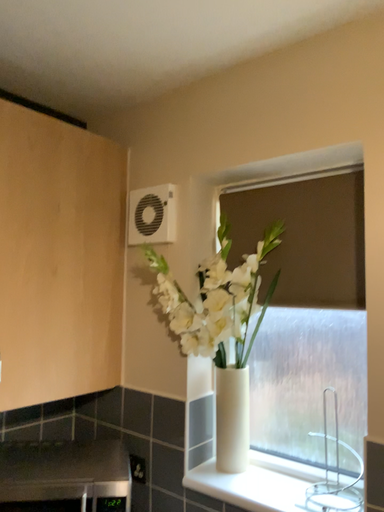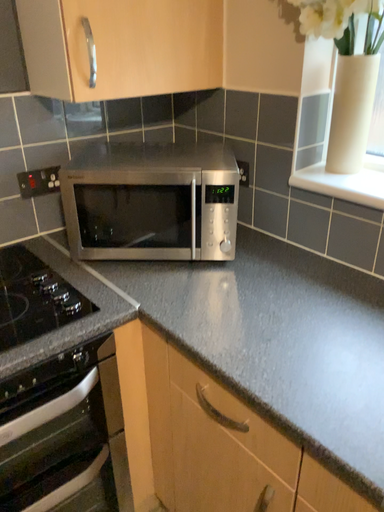
Question: Which way did the camera rotate in the video?

Choices:
 (A) rotated upward
 (B) rotated downward

Answer: (B)